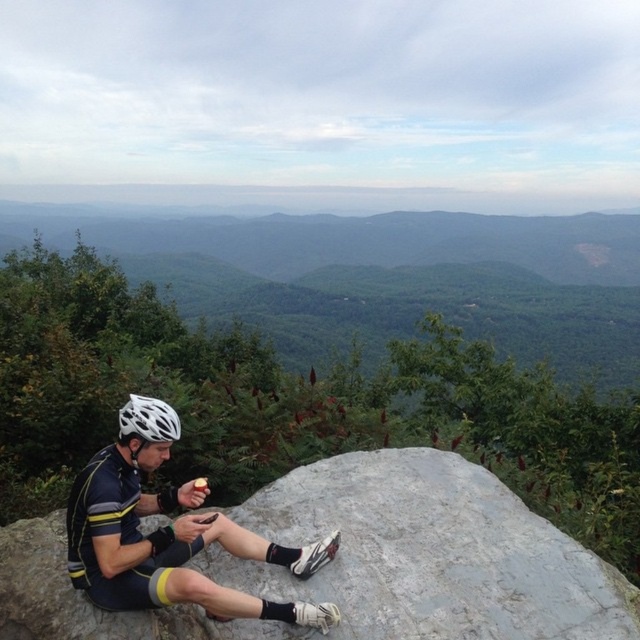
You are a hiker who wants to take a photo of the gray textured rock at center and the green leafy mountain at center. Which object should you focus on first if you want both to be in sharp focus?

The gray textured rock at center is smaller than the green leafy mountain at center, so you should focus on the green leafy mountain at center first to ensure both are in sharp focus.